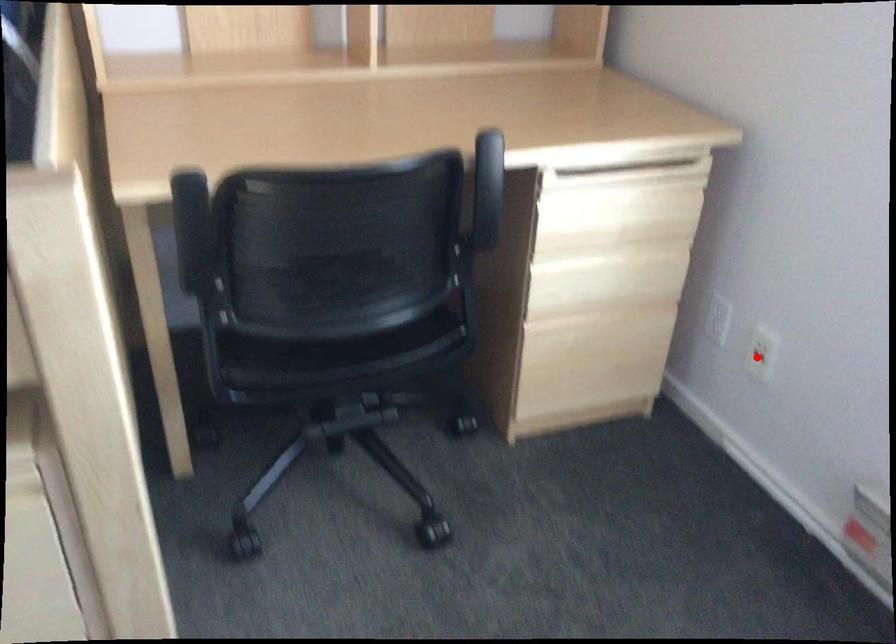
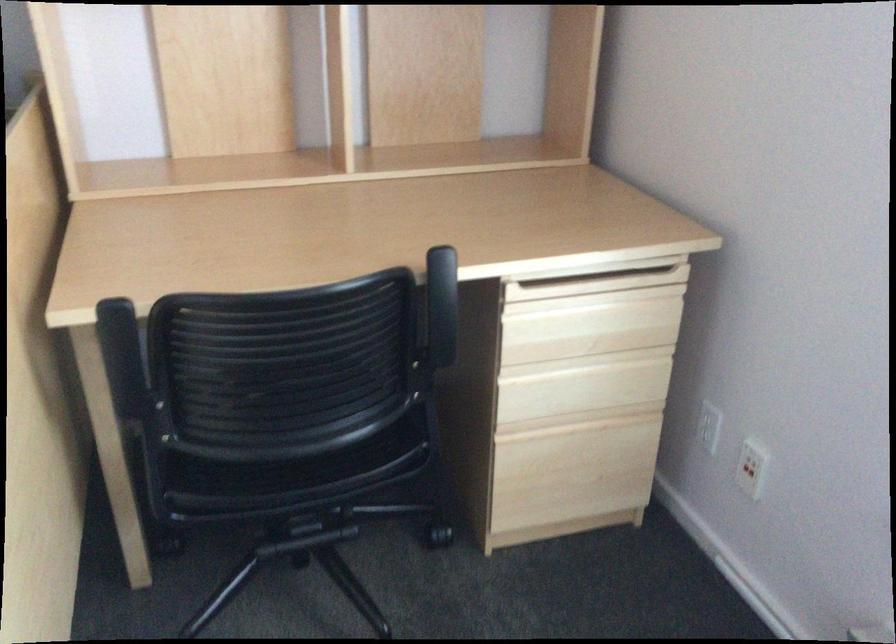
The point at the highlighted location is marked in the first image. Where is the corresponding point in the second image?

(747, 471)